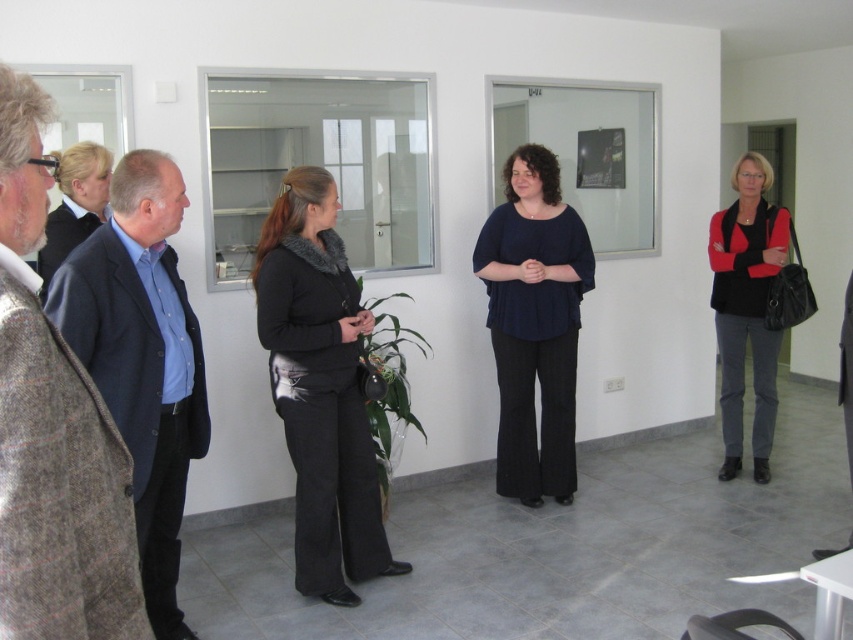
Question: Which object is positioned closest to the blue shirt at left?

Choices:
 (A) black fabric jacket at left
 (B) dark blue fabric blouse at center
 (C) dark blue suit at left
 (D) black matte pants at center

Answer: (C)

Question: Is blue shirt at left in front of dark blue fabric blouse at center?

Choices:
 (A) no
 (B) yes

Answer: (B)

Question: Does black matte pants at center appear over dark blue fabric blouse at center?

Choices:
 (A) no
 (B) yes

Answer: (A)

Question: Which point is closer to the camera?

Choices:
 (A) black fabric jacket at left
 (B) dark blue suit at left
 (C) black matte pants at center
 (D) matte black sweater at right

Answer: (B)

Question: Which point is closer to the camera taking this photo?

Choices:
 (A) (772, 352)
 (B) (67, 436)
 (C) (373, 486)

Answer: (B)

Question: Is blue shirt at left bigger than dark blue suit at left?

Choices:
 (A) yes
 (B) no

Answer: (B)